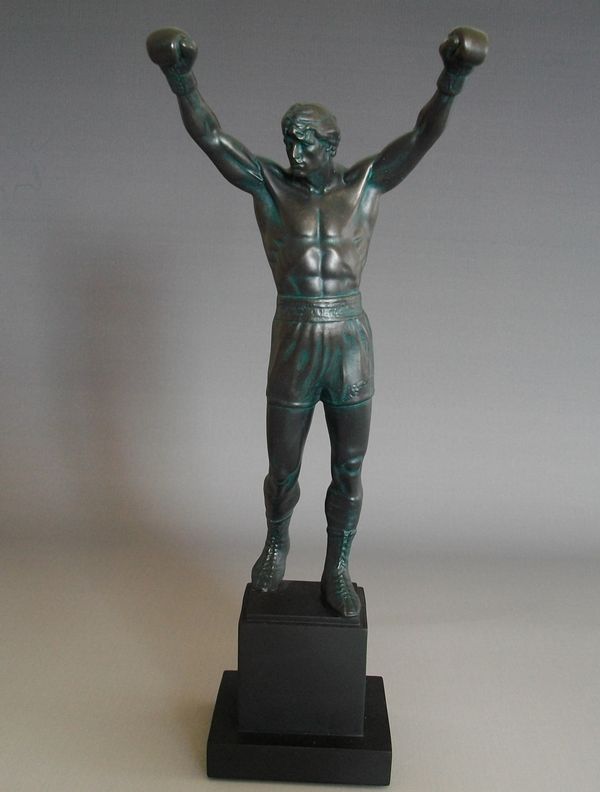
Identify the location of boxer statue. The image size is (600, 792). (318, 297).